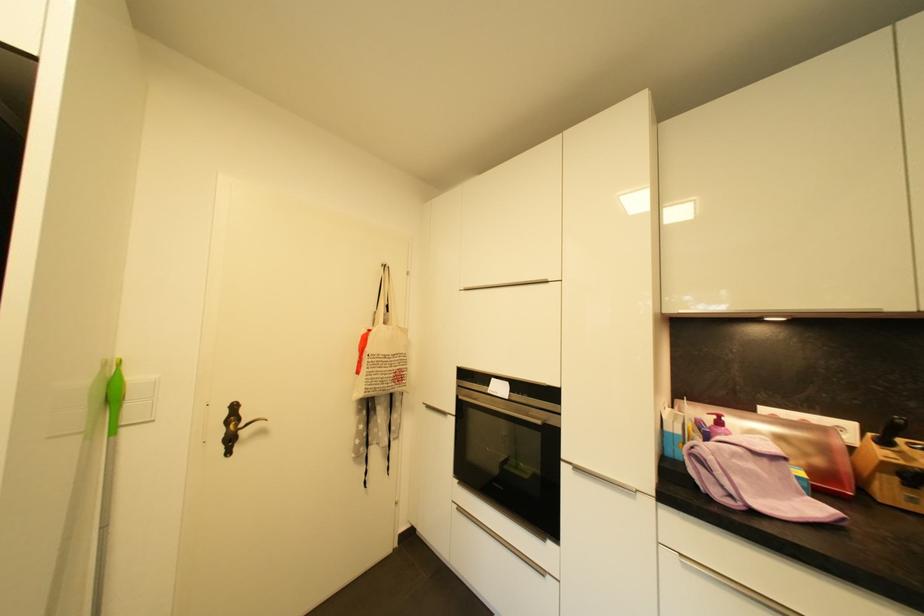
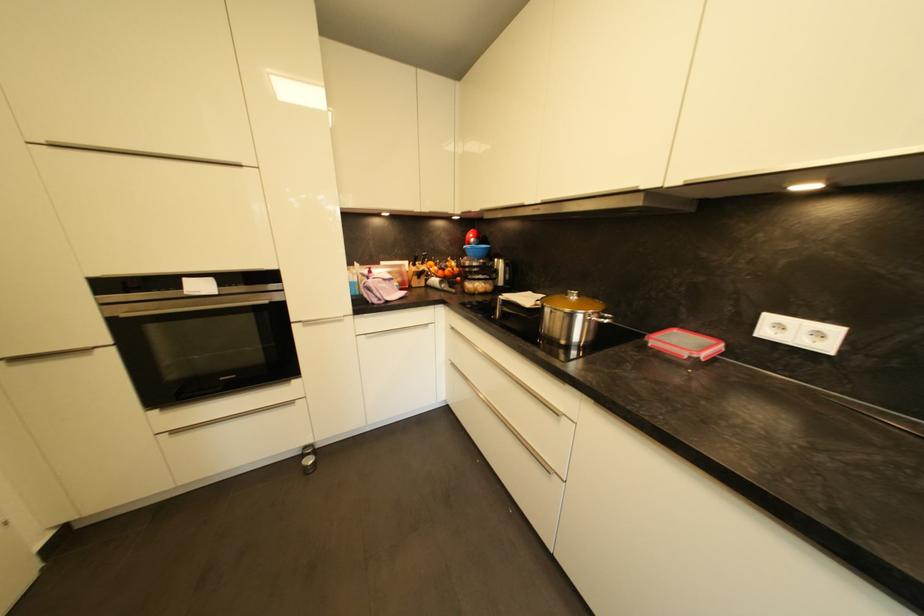
In the second image, find the point that corresponds to point 464,387 in the first image.

(107, 307)